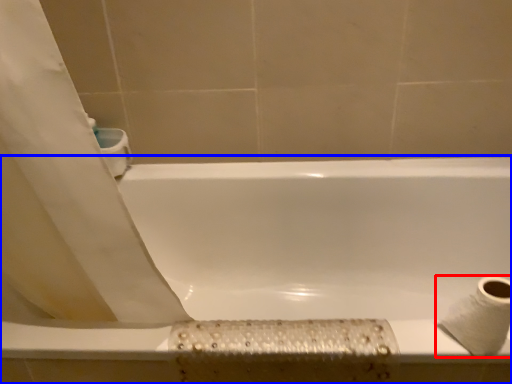
Question: Among these objects, which one is farthest to the camera, toilet paper (highlighted by a red box) or bathtub (highlighted by a blue box)?

Choices:
 (A) toilet paper
 (B) bathtub

Answer: (B)